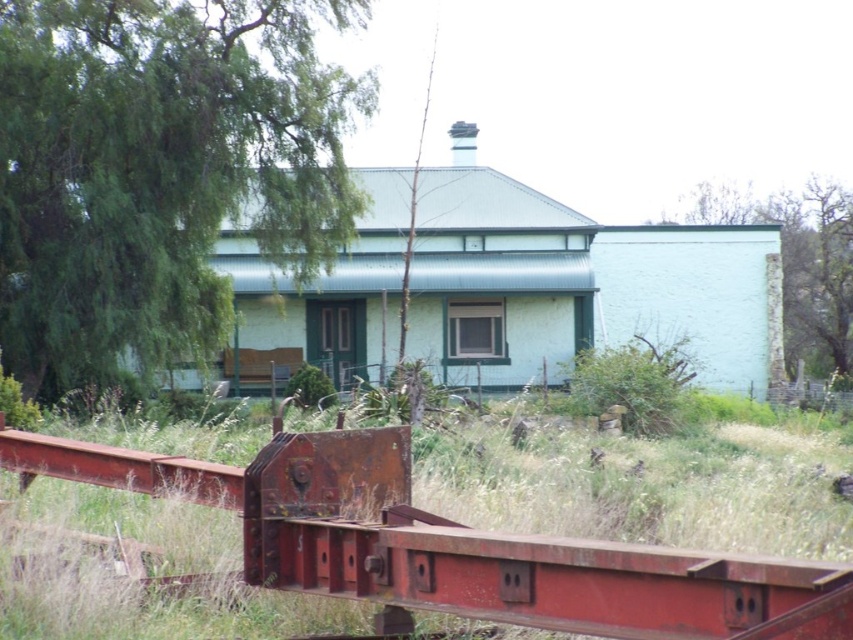
Question: Which of the following is the farthest from the observer?

Choices:
 (A) coord(154,77)
 (B) coord(810,221)

Answer: (B)

Question: Which of the following is the closest to the observer?

Choices:
 (A) green rough stone wall at upper right
 (B) green leafy tree at upper left

Answer: (B)

Question: Which point is closer to the camera?

Choices:
 (A) green leafy tree at upper left
 (B) green rough stone wall at upper right

Answer: (A)

Question: Can you confirm if green leafy tree at upper left is thinner than green rough stone wall at upper right?

Choices:
 (A) no
 (B) yes

Answer: (B)

Question: Does green leafy tree at upper left appear over green rough stone wall at upper right?

Choices:
 (A) no
 (B) yes

Answer: (A)

Question: Can you confirm if green leafy tree at upper left is positioned to the right of green rough stone wall at upper right?

Choices:
 (A) no
 (B) yes

Answer: (A)